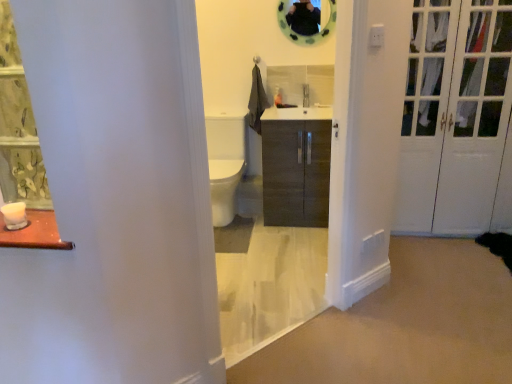
You are a GUI agent. You are given a task and a screenshot of the screen. Output one action in this format:
    pyautogui.click(x=<x>, y=<y>)
    Task: Click on the green rubber mirror at upper center
    The image size is (512, 384).
    Given the screenshot: What is the action you would take?
    pyautogui.click(x=302, y=35)

Where is `green floral fabric curtain at left`? This screenshot has height=384, width=512. green floral fabric curtain at left is located at coordinates (18, 126).

Describe the element at coordinates (18, 126) in the screenshot. I see `green floral fabric curtain at left` at that location.

Describe the element at coordinates (457, 120) in the screenshot. I see `white glossy door at right` at that location.

This screenshot has width=512, height=384. Describe the element at coordinates (260, 171) in the screenshot. I see `matte wood cabinet at center` at that location.

This screenshot has height=384, width=512. Find the location of `dark wood cabinet at center`. dark wood cabinet at center is located at coordinates (296, 172).

Locate an element on the screen. The width and height of the screenshot is (512, 384). green rubber mirror at upper center is located at coordinates (302, 35).

Is white glossy door at right to the right of dark wood cabinet at center from the viewer's perspective?

Indeed, white glossy door at right is positioned on the right side of dark wood cabinet at center.

From the image's perspective, would you say white glossy door at right is shown under dark wood cabinet at center?

No.

From a real-world perspective, who is located lower, white glossy door at right or dark wood cabinet at center?

From a 3D spatial view, dark wood cabinet at center is below.

Consider the image. Measure the distance from green rubber mirror at upper center to dark wood cabinet at center.

green rubber mirror at upper center and dark wood cabinet at center are 37.45 inches apart from each other.

Is green rubber mirror at upper center positioned far away from dark wood cabinet at center?

No.

Is green rubber mirror at upper center facing towards dark wood cabinet at center?

No.

Between green rubber mirror at upper center and dark wood cabinet at center, which one has larger width?

Wider between the two is dark wood cabinet at center.

Is green floral fabric curtain at left at the back of dark wood cabinet at center?

No.

Considering the relative sizes of dark wood cabinet at center and green floral fabric curtain at left in the image provided, is dark wood cabinet at center taller than green floral fabric curtain at left?

Yes, dark wood cabinet at center is taller than green floral fabric curtain at left.

From a real-world perspective, is dark wood cabinet at center below green floral fabric curtain at left?

Yes, from a real-world perspective, dark wood cabinet at center is under green floral fabric curtain at left.

Which is more to the right, dark wood cabinet at center or green floral fabric curtain at left?

dark wood cabinet at center is more to the right.

In the scene shown: Between white glossy door at right and matte wood cabinet at center, which one has larger size?

Bigger between the two is white glossy door at right.

Is white glossy door at right not inside matte wood cabinet at center?

Yes.

From a real-world perspective, which object stands above the other?

white glossy door at right, from a real-world perspective.

Is white glossy door at right not close to matte wood cabinet at center?

white glossy door at right is near matte wood cabinet at center, not far away.

Can you confirm if dark wood cabinet at center is smaller than green rubber mirror at upper center?

No.

The width and height of the screenshot is (512, 384). In order to click on cabinetry that appears on the right of green rubber mirror at upper center in this screenshot , I will do `click(296, 172)`.

How different are the orientations of dark wood cabinet at center and green rubber mirror at upper center in degrees?

The angle between the facing direction of dark wood cabinet at center and the facing direction of green rubber mirror at upper center is 0.0867 degrees.

Consider the image. Considering the sizes of objects dark wood cabinet at center and green rubber mirror at upper center in the image provided, who is shorter, dark wood cabinet at center or green rubber mirror at upper center?

green rubber mirror at upper center is shorter.

Which object is thinner, green rubber mirror at upper center or matte wood cabinet at center?

With smaller width is green rubber mirror at upper center.

Find the location of a particular element. mirror behind the matte wood cabinet at center is located at coordinates (302, 35).

Consider the image. Considering the positions of objects green rubber mirror at upper center and matte wood cabinet at center in the image provided, who is more to the right, green rubber mirror at upper center or matte wood cabinet at center?

Positioned to the right is green rubber mirror at upper center.

Considering the positions of objects green rubber mirror at upper center and matte wood cabinet at center in the image provided, who is in front, green rubber mirror at upper center or matte wood cabinet at center?

matte wood cabinet at center is closer to the camera.

At what (x,y) coordinates should I click in order to perform the action: click on door that is behind the green floral fabric curtain at left. Please return your answer as a coordinate pair (x, y). Looking at the image, I should click on (457, 120).

In the scene shown: From the image's perspective, is green floral fabric curtain at left above white glossy door at right?

Incorrect, from the image's perspective, green floral fabric curtain at left is lower than white glossy door at right.

From a real-world perspective, is green floral fabric curtain at left positioned under white glossy door at right based on gravity?

No, from a real-world perspective, green floral fabric curtain at left is not below white glossy door at right.

Where is `cabinetry behind the white glossy door at right`? This screenshot has width=512, height=384. cabinetry behind the white glossy door at right is located at coordinates (296, 172).

Locate an element on the screen. cabinetry to the right of green rubber mirror at upper center is located at coordinates (296, 172).

When comparing their distances from matte wood cabinet at center, does green floral fabric curtain at left or green rubber mirror at upper center seem further?

green floral fabric curtain at left.

Which object lies nearer to the anchor point green floral fabric curtain at left, white glossy door at right or matte wood cabinet at center?

matte wood cabinet at center is closer to green floral fabric curtain at left.

From the picture: Looking at the image, which one is located closer to dark wood cabinet at center, white glossy door at right or green floral fabric curtain at left?

white glossy door at right.

From the image, which object appears to be nearer to green floral fabric curtain at left, dark wood cabinet at center or green rubber mirror at upper center?

dark wood cabinet at center lies closer to green floral fabric curtain at left than the other object.

Looking at the image, which one is located further to white glossy door at right, green floral fabric curtain at left or matte wood cabinet at center?

The object further to white glossy door at right is green floral fabric curtain at left.

Which object lies further to the anchor point green floral fabric curtain at left, white glossy door at right or dark wood cabinet at center?

white glossy door at right lies further to green floral fabric curtain at left than the other object.

Consider the image. Based on their spatial positions, is white glossy door at right or green floral fabric curtain at left closer to green rubber mirror at upper center?

white glossy door at right.

From the picture: Based on their spatial positions, is green floral fabric curtain at left or dark wood cabinet at center further from green rubber mirror at upper center?

green floral fabric curtain at left lies further to green rubber mirror at upper center than the other object.

Where is `door between matte wood cabinet at center and green rubber mirror at upper center in the front-back direction`? The width and height of the screenshot is (512, 384). door between matte wood cabinet at center and green rubber mirror at upper center in the front-back direction is located at coordinates (457, 120).

Locate an element on the screen. This screenshot has width=512, height=384. corridor between green floral fabric curtain at left and white glossy door at right is located at coordinates (260, 171).

At what (x,y) coordinates should I click in order to perform the action: click on mirror between green floral fabric curtain at left and white glossy door at right from left to right. Please return your answer as a coordinate pair (x, y). Image resolution: width=512 pixels, height=384 pixels. Looking at the image, I should click on (302, 35).

Identify the location of cabinetry situated between green floral fabric curtain at left and white glossy door at right from left to right. (296, 172).